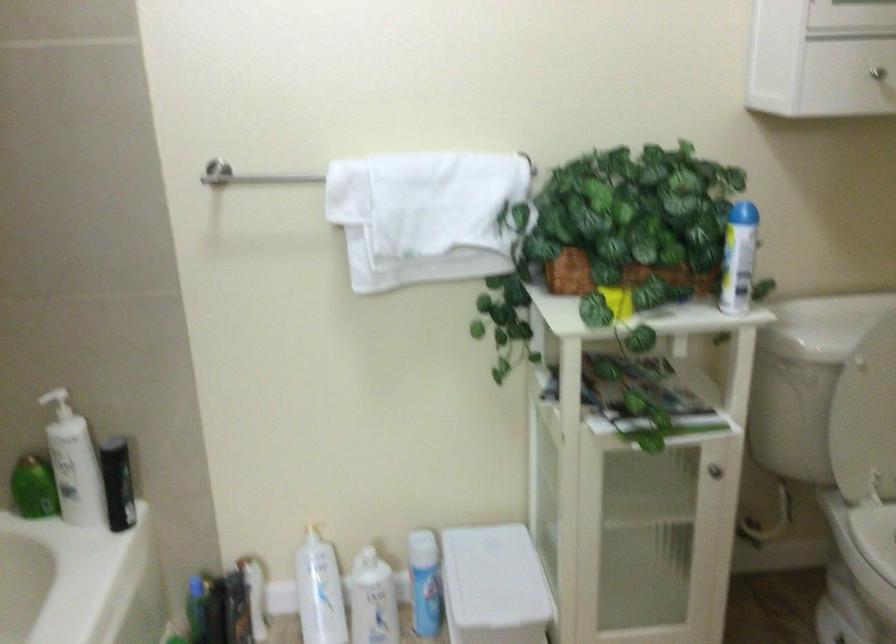
Where is `white box lid`? white box lid is located at coordinates (493, 580).